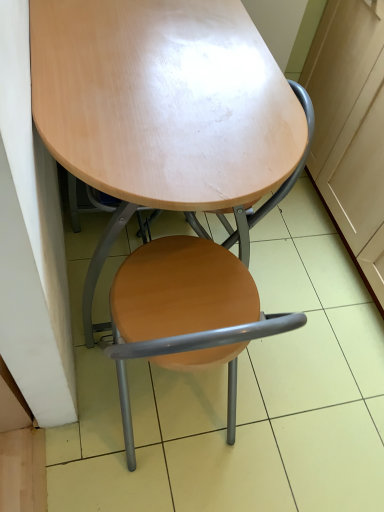
Question: Is point (125, 367) closer or farther from the camera than point (104, 239)?

Choices:
 (A) farther
 (B) closer

Answer: (A)

Question: Which is correct: wooden seat at center is inside glossy wood table at center, or outside of it?

Choices:
 (A) outside
 (B) inside

Answer: (B)

Question: Which of these objects is positioned farthest from the wooden seat at center?

Choices:
 (A) matte wood cabinet at right
 (B) glossy wood table at center

Answer: (A)

Question: Based on their relative distances, which object is nearer to the matte wood cabinet at right?

Choices:
 (A) wooden seat at center
 (B) glossy wood table at center

Answer: (A)